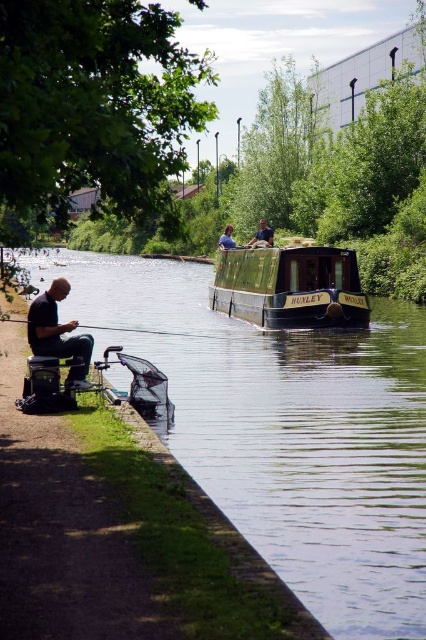
You are a photographer trying to capture the scene from the riverside. You notice the green polished wood boat at center and the dark blue shirt at center. Which object is positioned lower in the image?

The green polished wood boat at center is located below the dark blue shirt at center, so it is positioned lower in the image.

You are standing at the point marked by coordinates point [285,429]. What object is located exactly at this point?

The green wooden boat at center is located exactly at point [285,429].